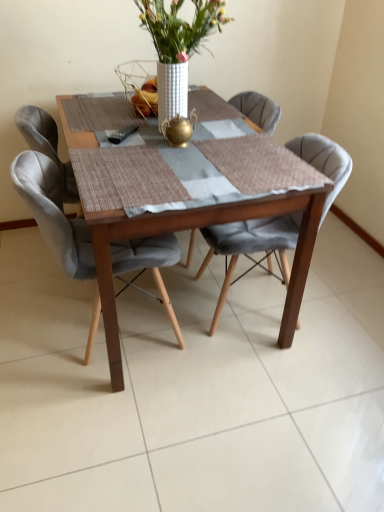
Identify the location of space that is in front of white textured vase at center. (224, 176).